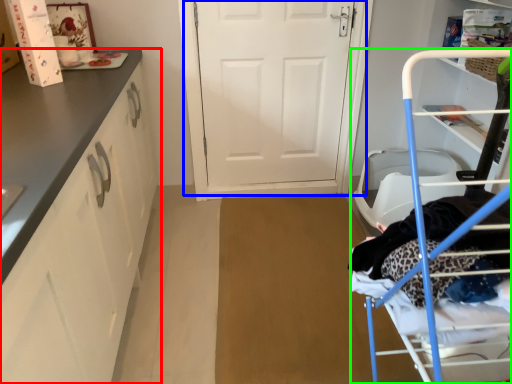
Question: Which object is positioned closest to cabinetry (highlighted by a red box)? Select from door (highlighted by a blue box) and furniture (highlighted by a green box).

Choices:
 (A) door
 (B) furniture

Answer: (B)